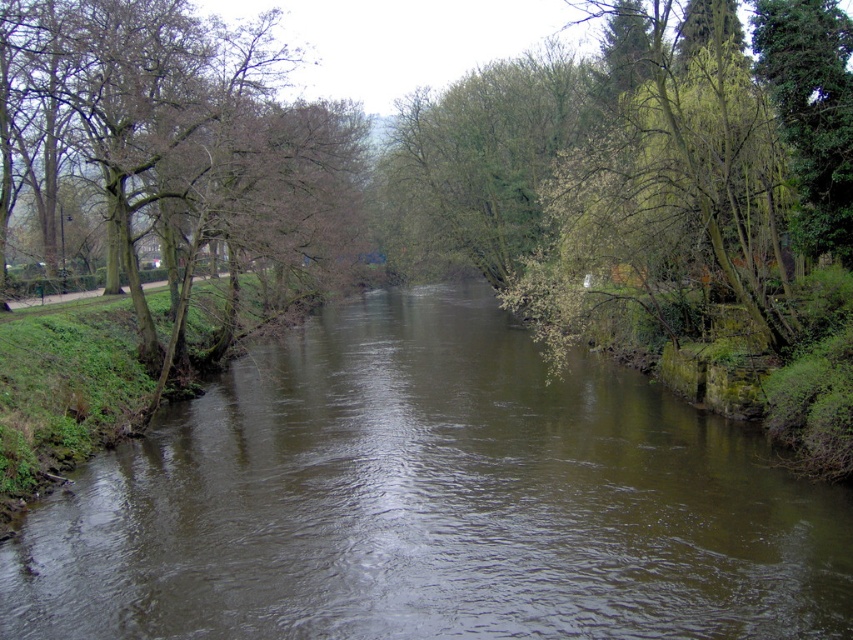
Question: Is brown muddy stream at center smaller than brown leafy tree at left?

Choices:
 (A) no
 (B) yes

Answer: (B)

Question: Which point appears closest to the camera in this image?

Choices:
 (A) [300, 516]
 (B) [305, 221]

Answer: (A)

Question: Does brown muddy stream at center appear over brown leafy tree at left?

Choices:
 (A) yes
 (B) no

Answer: (B)

Question: Is brown muddy stream at center to the right of brown leafy tree at left from the viewer's perspective?

Choices:
 (A) no
 (B) yes

Answer: (B)

Question: Among these points, which one is farthest from the camera?

Choices:
 (A) (38, 621)
 (B) (173, 355)

Answer: (B)

Question: Which object is closer to the camera taking this photo?

Choices:
 (A) brown leafy tree at left
 (B) brown muddy stream at center

Answer: (B)